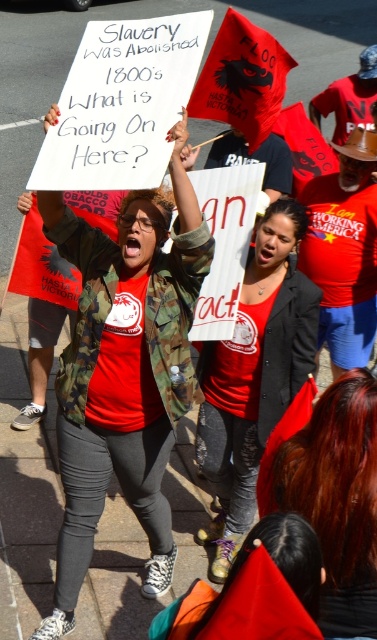
Which is below, matte red t-shirt at center or matte black blazer at center?

matte black blazer at center is below.

Who is more distant from viewer, (61, 566) or (263, 291)?

The point (263, 291) is more distant.

Where is `matte red t-shirt at center`? matte red t-shirt at center is located at coordinates (125, 371).

Which of these two, matte black blazer at center or shiny red hair at center, stands taller?

With more height is matte black blazer at center.

Between point (231, 460) and point (357, 557), which one is positioned behind?

The point (231, 460) is behind.

Identify the location of matte black blazer at center. (254, 376).

Between point (119, 368) and point (332, 504), which one is positioned in front?

Point (332, 504) is in front.

Does matte red t-shirt at center appear on the right side of shiny red hair at center?

No, matte red t-shirt at center is not to the right of shiny red hair at center.

You are a GUI agent. You are given a task and a screenshot of the screen. Output one action in this format:
    pyautogui.click(x=<x>, y=<y>)
    Task: Click on the matte red t-shirt at center
    Image resolution: width=377 pixels, height=640 pixels.
    Given the screenshot: What is the action you would take?
    pyautogui.click(x=125, y=371)

Where is `matte red t-shirt at center`? matte red t-shirt at center is located at coordinates (125, 371).